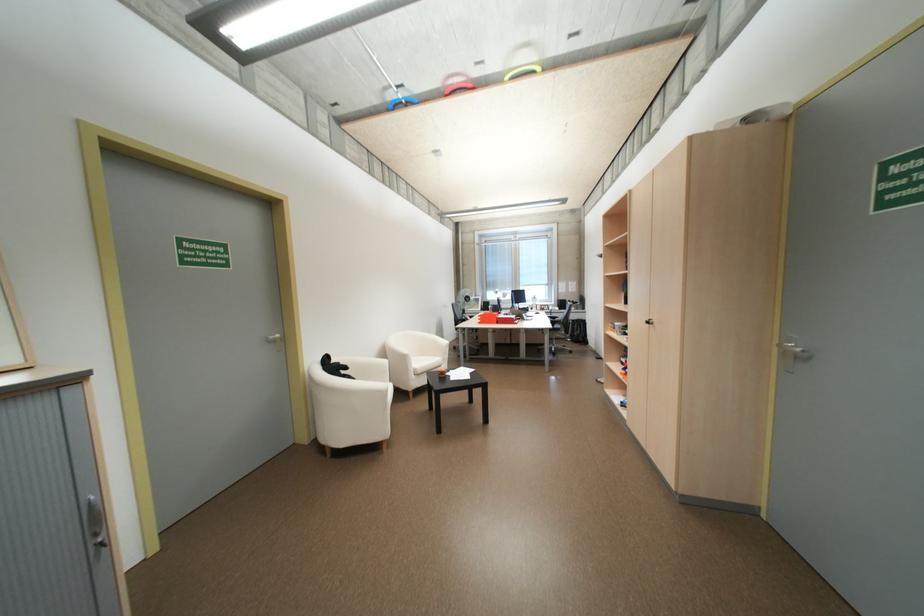
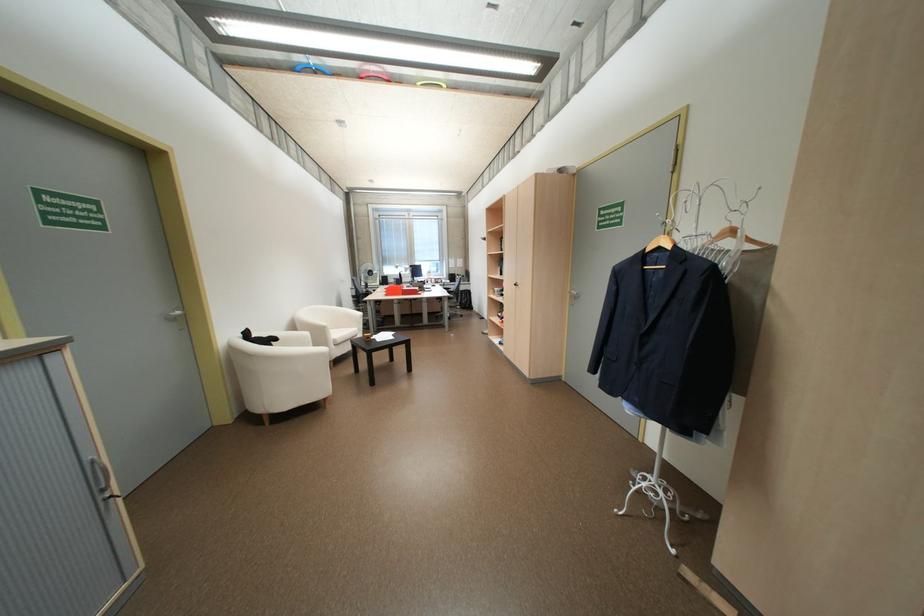
Question: The camera is either moving clockwise (left) or counter-clockwise (right) around the object. The first image is from the beginning of the video and the second image is from the end. Is the camera moving left or right when shooting the video?

Choices:
 (A) Left
 (B) Right

Answer: (A)